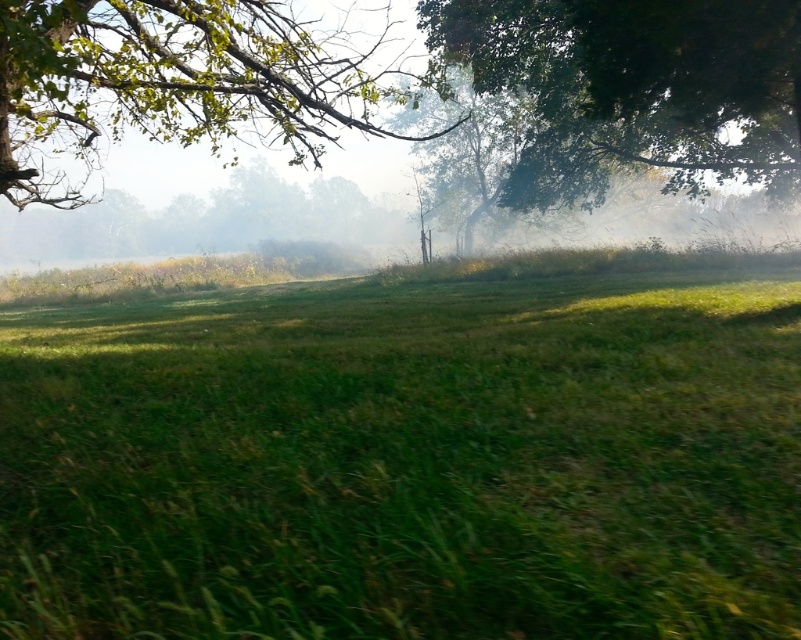
Who is positioned more to the left, green leafy tree at upper right or green leafy tree at upper left?

green leafy tree at upper left is more to the left.

Between green leafy tree at upper right and green leafy tree at upper left, which one is positioned lower?

green leafy tree at upper right

Who is more distant from viewer, (643,13) or (352,35)?

Point (352,35)

Locate an element on the screen. green leafy tree at upper right is located at coordinates (634, 88).

The height and width of the screenshot is (640, 801). I want to click on green grassy field at center, so click(x=407, y=461).

Can you confirm if green grassy field at center is taller than green leafy tree at upper right?

No.

What do you see at coordinates (407, 461) in the screenshot?
I see `green grassy field at center` at bounding box center [407, 461].

Locate an element on the screen. green grassy field at center is located at coordinates (407, 461).

Is green grassy field at center above green leafy tree at upper left?

Incorrect, green grassy field at center is not positioned above green leafy tree at upper left.

Image resolution: width=801 pixels, height=640 pixels. I want to click on green grassy field at center, so click(407, 461).

Between point (405, 440) and point (321, 124), which one is positioned behind?

Point (321, 124)

At what (x,y) coordinates should I click in order to perform the action: click on green grassy field at center. Please return your answer as a coordinate pair (x, y). Looking at the image, I should click on (407, 461).